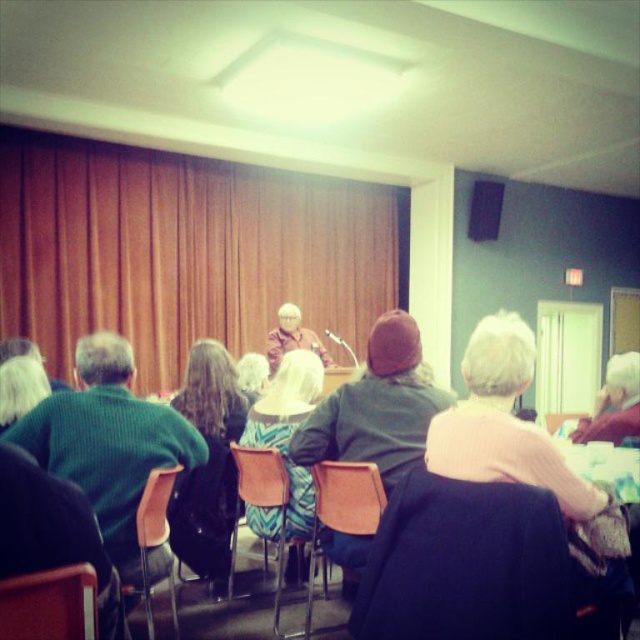
You are organizing a photo shoot in the room and need to arrange two props. The green knitted sweater at left and the dark brown leather jacket at center are already placed. Which prop takes up more horizontal space?

The green knitted sweater at left takes up more horizontal space since its width surpasses that of the dark brown leather jacket at center.

You are an event organizer who needs to seat an additional guest. There is a chair available behind the dark brown leather jacket at center. Can the guest sit there without blocking the view of the green knitted sweater at left?

A: The green knitted sweater at left is in front of the dark brown leather jacket at center, so placing the guest behind the dark brown leather jacket at center would not block the view of the green knitted sweater at left.